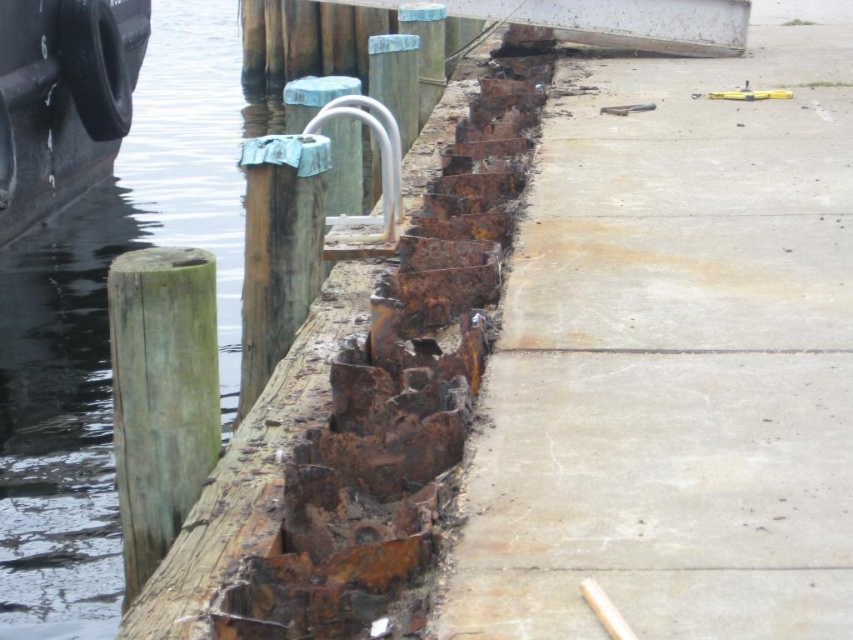
Between green wood post at left and black rubber tire at left, which one is positioned lower?

green wood post at left

Is green wood post at left taller than black rubber tire at left?

No, green wood post at left is not taller than black rubber tire at left.

You are a GUI agent. You are given a task and a screenshot of the screen. Output one action in this format:
    pyautogui.click(x=<x>, y=<y>)
    Task: Click on the green wood post at left
    The width and height of the screenshot is (853, 640).
    Given the screenshot: What is the action you would take?
    pyautogui.click(x=161, y=396)

Does rusty metal water at left come behind rusty wood post at center?

No, rusty metal water at left is in front of rusty wood post at center.

Between point (207, 216) and point (445, 13), which one is positioned in front?

Point (445, 13) is in front.

Identify the location of rusty metal water at left. The height and width of the screenshot is (640, 853). (106, 320).

Locate an element on the screen. Image resolution: width=853 pixels, height=640 pixels. rusty metal water at left is located at coordinates (106, 320).

Identify the location of rusty metal water at left. The height and width of the screenshot is (640, 853). (106, 320).